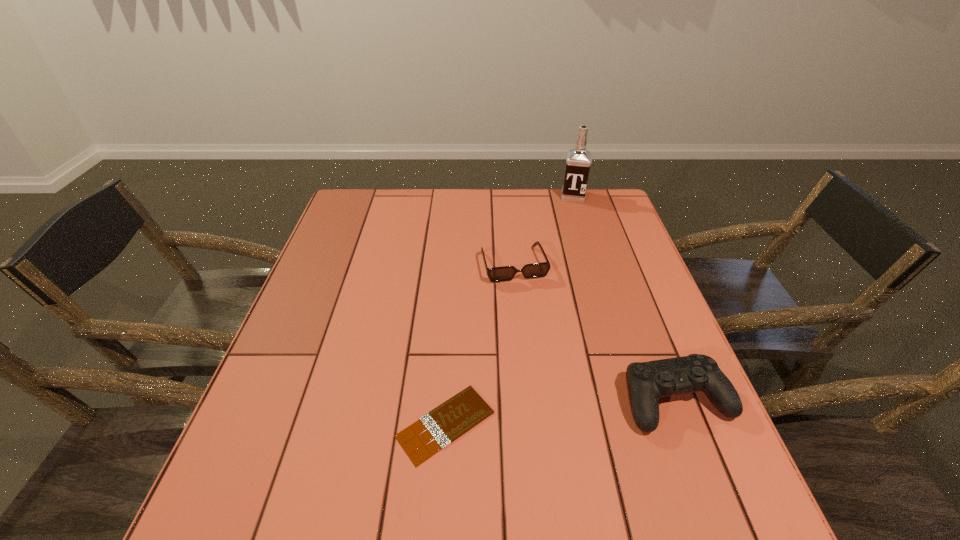
I want to click on vacant region between the sunglasses and the control, so click(x=595, y=332).

Identify the location of blank region between the chocolate bar and the vodka. (510, 310).

The height and width of the screenshot is (540, 960). I want to click on free space between the farthest object and the shortest object, so click(x=510, y=310).

You are a GUI agent. You are given a task and a screenshot of the screen. Output one action in this format:
    pyautogui.click(x=<x>, y=<y>)
    Task: Click on the free space between the farthest object and the second tallest object
    
    Given the screenshot: What is the action you would take?
    pyautogui.click(x=625, y=298)

Find the location of a particular element. This screenshot has height=540, width=960. empty space that is in between the control and the chocolate bar is located at coordinates (561, 412).

Identify the location of empty location between the chocolate bar and the vodka. (510, 310).

Identify the location of vacant space that's between the chocolate bar and the sunglasses. (480, 344).

I want to click on object that can be found as the second closest to the tallest object, so click(647, 382).

What are the coordinates of `object that is the second closest to the control` in the screenshot? It's located at (535, 270).

Identify the location of vacant area in the image that satisfies the following two spatial constraints: 1. on the back side of the control; 2. on the right side of the shortest object. (447, 400).